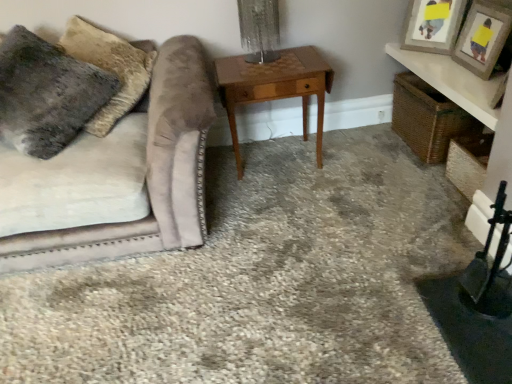
Question: From the image's perspective, is wooden picture frame at upper right, which ranks as the 2th picture frame in front-to-back order, positioned above or below wooden picture frame at upper right, which is the 1th picture frame in front-to-back order?

Choices:
 (A) below
 (B) above

Answer: (B)

Question: Is wooden picture frame at upper right, which ranks as the 2th picture frame in front-to-back order, wider or thinner than wooden picture frame at upper right, which is the 1th picture frame in front-to-back order?

Choices:
 (A) thin
 (B) wide

Answer: (A)

Question: Which object is the farthest from the fuzzy gray pillow at upper left?

Choices:
 (A) wooden picture frame at upper right, marked as the first picture frame in a back-to-front arrangement
 (B) wooden picture frame at upper right, placed as the second picture frame when sorted from back to front
 (C) light brown wood table at center
 (D) velvet beige couch at left

Answer: (B)

Question: Which object is the closest to the velvet beige couch at left?

Choices:
 (A) fuzzy gray pillow at upper left
 (B) wooden picture frame at upper right, which ranks as the 2th picture frame in front-to-back order
 (C) wooden picture frame at upper right, which is the 1th picture frame in front-to-back order
 (D) light brown wood table at center

Answer: (A)